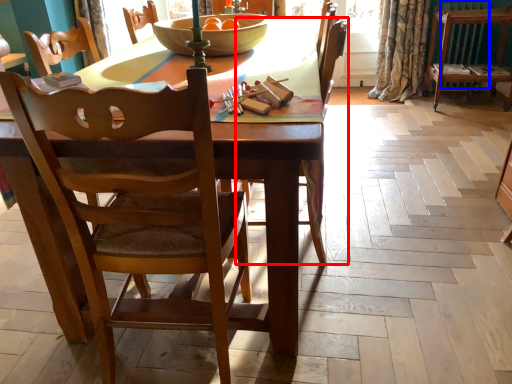
Question: Which object appears farthest to the camera in this image, chair (highlighted by a red box) or radiator (highlighted by a blue box)?

Choices:
 (A) chair
 (B) radiator

Answer: (B)